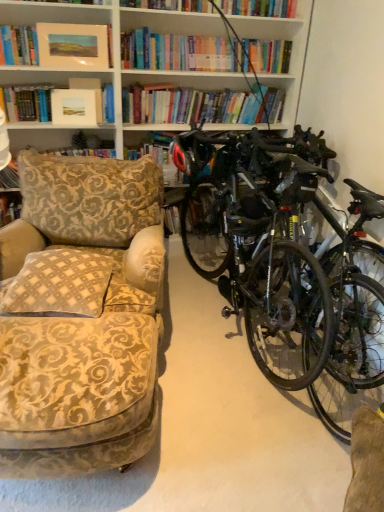
Question: Does beige checkered pillow at left have a greater width compared to matte white picture frame at upper center?

Choices:
 (A) no
 (B) yes

Answer: (B)

Question: Can you confirm if beige checkered pillow at left is shorter than matte white picture frame at upper center?

Choices:
 (A) no
 (B) yes

Answer: (B)

Question: From the image's perspective, is beige checkered pillow at left located above matte white picture frame at upper center?

Choices:
 (A) no
 (B) yes

Answer: (A)

Question: Considering the relative positions of beige checkered pillow at left and matte white picture frame at upper center in the image provided, is beige checkered pillow at left in front of matte white picture frame at upper center?

Choices:
 (A) yes
 (B) no

Answer: (A)

Question: Is matte white picture frame at upper center inside beige checkered pillow at left?

Choices:
 (A) yes
 (B) no

Answer: (B)

Question: Is matte white picture frame at upper center in front of or behind shiny black bicycle at right in the image?

Choices:
 (A) behind
 (B) front

Answer: (A)

Question: In the image, is matte white picture frame at upper center on the left side or the right side of shiny black bicycle at right?

Choices:
 (A) right
 (B) left

Answer: (B)

Question: Is matte white picture frame at upper center inside the boundaries of shiny black bicycle at right, or outside?

Choices:
 (A) inside
 (B) outside

Answer: (B)

Question: Is matte white picture frame at upper center wider or thinner than shiny black bicycle at right?

Choices:
 (A) wide
 (B) thin

Answer: (B)

Question: Looking at their shapes, would you say beige checkered pillow at left is wider or thinner than patterned fabric cushion at left, which ranks as the first book in back-to-front order?

Choices:
 (A) thin
 (B) wide

Answer: (B)

Question: Considering the positions of point (56, 285) and point (61, 153), is point (56, 285) closer or farther from the camera than point (61, 153)?

Choices:
 (A) closer
 (B) farther

Answer: (A)

Question: From a real-world perspective, relative to patterned fabric cushion at left, which ranks as the first book in back-to-front order, is beige checkered pillow at left vertically above or below?

Choices:
 (A) below
 (B) above

Answer: (A)

Question: From their relative heights in the image, would you say beige checkered pillow at left is taller or shorter than patterned fabric cushion at left, which ranks as the first book in back-to-front order?

Choices:
 (A) short
 (B) tall

Answer: (A)

Question: From a real-world perspective, is shiny black bicycle at right physically located above or below matte black helmet at center?

Choices:
 (A) above
 (B) below

Answer: (B)

Question: Is shiny black bicycle at right to the left or to the right of matte black helmet at center in the image?

Choices:
 (A) right
 (B) left

Answer: (A)